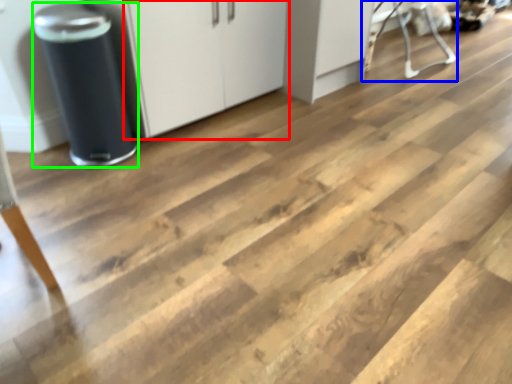
Question: Which is nearer to the cabinetry (highlighted by a red box)? furniture (highlighted by a blue box) or appliance (highlighted by a green box).

Choices:
 (A) furniture
 (B) appliance

Answer: (B)